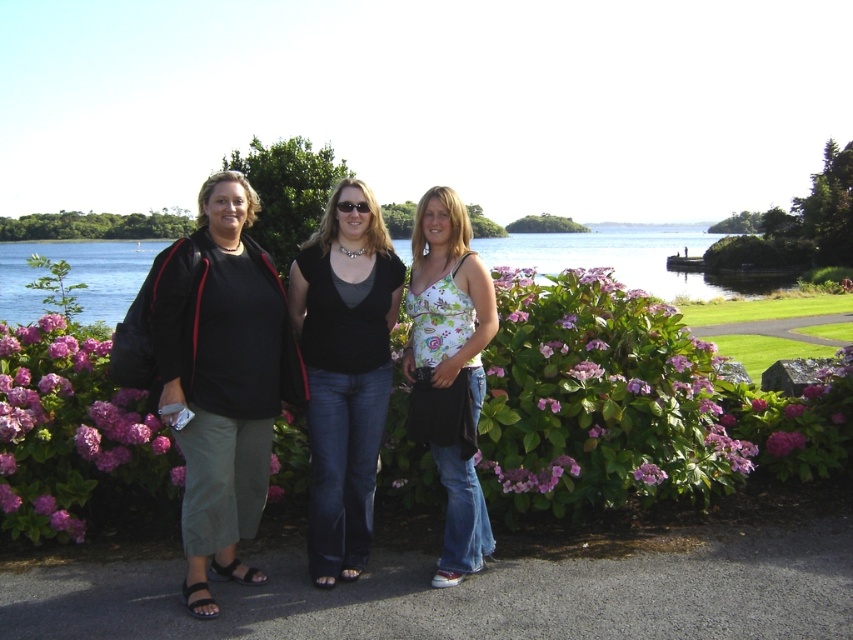
Question: Considering the relative positions of matte black top at center and purple matte flower at center in the image provided, where is matte black top at center located with respect to purple matte flower at center?

Choices:
 (A) right
 (B) left

Answer: (B)

Question: Estimate the real-world distances between objects in this image. Which object is closer to the matte black top at center?

Choices:
 (A) matte black jacket at left
 (B) floral print tank top at center
 (C) purple matte flower at center
 (D) purple matte flower at lower center

Answer: (B)

Question: Which point appears farthest from the camera in this image?

Choices:
 (A) (786, 436)
 (B) (352, 300)

Answer: (A)

Question: Can you confirm if blue water at center is wider than purple matte flower at lower center?

Choices:
 (A) no
 (B) yes

Answer: (B)

Question: Is matte black top at center closer to camera compared to floral print tank top at center?

Choices:
 (A) yes
 (B) no

Answer: (A)

Question: Which point is farther to the camera?

Choices:
 (A) purple matte flower at center
 (B) purple matte flower at lower center

Answer: (A)